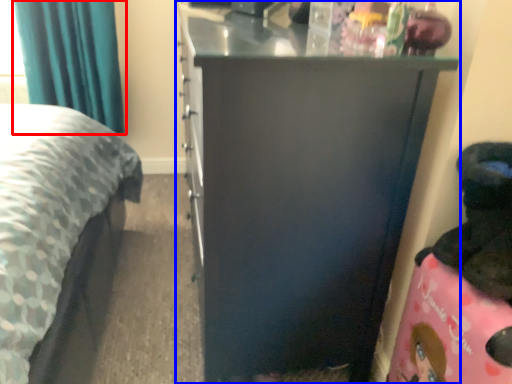
Question: Among these objects, which one is nearest to the camera, curtain (highlighted by a red box) or furniture (highlighted by a blue box)?

Choices:
 (A) curtain
 (B) furniture

Answer: (B)